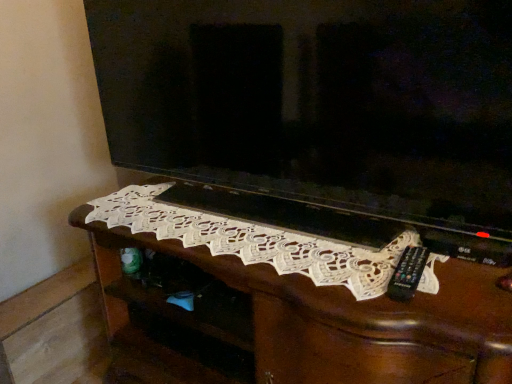
Question: Can you confirm if white lace doily at center is wider than matte black television at center?

Choices:
 (A) no
 (B) yes

Answer: (B)

Question: Is there a large distance between white lace doily at center and matte black television at center?

Choices:
 (A) yes
 (B) no

Answer: (B)

Question: From a real-world perspective, is white lace doily at center below matte black television at center?

Choices:
 (A) no
 (B) yes

Answer: (B)

Question: Is white lace doily at center in contact with matte black television at center?

Choices:
 (A) no
 (B) yes

Answer: (A)

Question: Considering the relative sizes of white lace doily at center and matte black television at center in the image provided, is white lace doily at center shorter than matte black television at center?

Choices:
 (A) no
 (B) yes

Answer: (B)

Question: Considering the relative positions of white lace doily at center and matte black television at center in the image provided, is white lace doily at center to the right of matte black television at center from the viewer's perspective?

Choices:
 (A) no
 (B) yes

Answer: (A)

Question: Does matte black television at center touch white lace doily at center?

Choices:
 (A) no
 (B) yes

Answer: (A)

Question: Is matte black television at center outside of white lace doily at center?

Choices:
 (A) no
 (B) yes

Answer: (B)

Question: From a real-world perspective, is matte black television at center located higher than white lace doily at center?

Choices:
 (A) no
 (B) yes

Answer: (B)

Question: Considering the relative sizes of matte black television at center and white lace doily at center in the image provided, is matte black television at center wider than white lace doily at center?

Choices:
 (A) yes
 (B) no

Answer: (B)

Question: Is matte black television at center bigger than white lace doily at center?

Choices:
 (A) yes
 (B) no

Answer: (A)

Question: Is there a large distance between matte black television at center and white lace doily at center?

Choices:
 (A) yes
 (B) no

Answer: (B)

Question: Is white lace doily at center outside of matte black television at center?

Choices:
 (A) no
 (B) yes

Answer: (B)